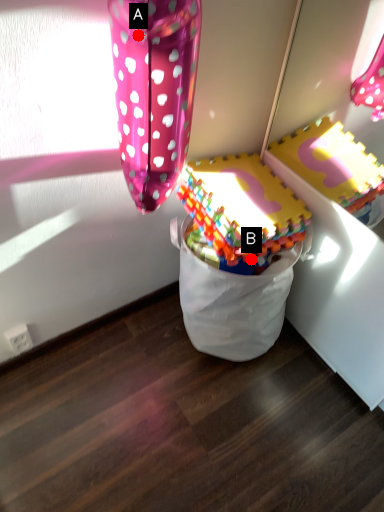
Question: Two points are circled on the image, labeled by A and B beside each circle. Which point is farther to the camera?

Choices:
 (A) A is further
 (B) B is further

Answer: (B)